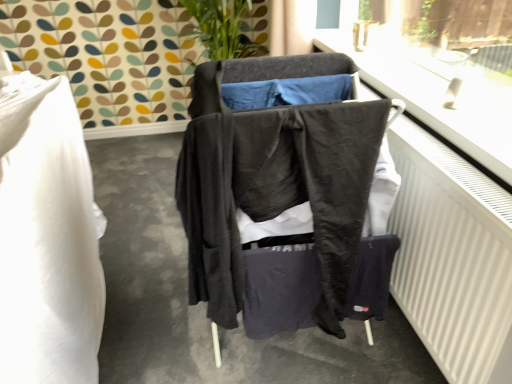
What are the coordinates of `matte black clothing at center` in the screenshot? It's located at (205, 304).

I want to click on matte black clothing at center, so click(205, 304).

Is white plastic window frame at upper right aimed at white fluffy pillow at left?

No, white plastic window frame at upper right does not turn towards white fluffy pillow at left.

From the image's perspective, between white plastic window frame at upper right and white fluffy pillow at left, which one is located above?

white plastic window frame at upper right is shown above in the image.

Can you tell me how much white plastic window frame at upper right and white fluffy pillow at left differ in facing direction?

They differ by 1.03 degrees in their facing directions.

Is white plastic window frame at upper right not near white fluffy pillow at left?

Absolutely, white plastic window frame at upper right is distant from white fluffy pillow at left.

From the image's perspective, does matte black clothing at center appear higher than white plastic window frame at upper right?

No, from the image's perspective, matte black clothing at center is not above white plastic window frame at upper right.

Is matte black clothing at center positioned with its back to white plastic window frame at upper right?

matte black clothing at center is not turned away from white plastic window frame at upper right.

Relative to white plastic window frame at upper right, is matte black clothing at center in front or behind?

Clearly, matte black clothing at center is behind white plastic window frame at upper right.

Does matte black clothing at center touch white plastic window frame at upper right?

There is a gap between matte black clothing at center and white plastic window frame at upper right.

Consider the image. Which of these two, dark gray fabric jacket at center or matte black clothing at center, is thinner?

dark gray fabric jacket at center is thinner.

Is dark gray fabric jacket at center looking in the opposite direction of matte black clothing at center?

dark gray fabric jacket at center does not have its back to matte black clothing at center.

The width and height of the screenshot is (512, 384). Find the location of `concrete below the dark gray fabric jacket at center (from a real-world perspective)`. concrete below the dark gray fabric jacket at center (from a real-world perspective) is located at coordinates (205, 304).

Is matte black clothing at center surrounded by dark gray fabric jacket at center?

No, matte black clothing at center is not surrounded by dark gray fabric jacket at center.

Considering the relative positions of white matte radiator at right and white plastic window frame at upper right in the image provided, is white matte radiator at right to the left or to the right of white plastic window frame at upper right?

From the image, it's evident that white matte radiator at right is to the left of white plastic window frame at upper right.

Which point is more distant from viewer, (451,218) or (423,76)?

The point (423,76) is farther from the camera.

Can you confirm if white matte radiator at right is taller than white plastic window frame at upper right?

Correct, white matte radiator at right is much taller as white plastic window frame at upper right.

Is white matte radiator at right wider than white plastic window frame at upper right?

In fact, white matte radiator at right might be narrower than white plastic window frame at upper right.

Based on the photo, what's the angular difference between dark gray fabric jacket at center and white plastic window frame at upper right's facing directions?

The angle between the facing direction of dark gray fabric jacket at center and the facing direction of white plastic window frame at upper right is 2.27 degrees.

How far apart are dark gray fabric jacket at center and white plastic window frame at upper right?

dark gray fabric jacket at center and white plastic window frame at upper right are 26.25 inches apart.

Is point (338, 115) more distant than point (485, 137)?

No, (338, 115) is in front of (485, 137).

Are dark gray fabric jacket at center and white plastic window frame at upper right located far from each other?

Actually, dark gray fabric jacket at center and white plastic window frame at upper right are a little close together.

Would you consider dark gray fabric jacket at center to be distant from white matte radiator at right?

Actually, dark gray fabric jacket at center and white matte radiator at right are a little close together.

Between dark gray fabric jacket at center and white matte radiator at right, which one appears on the left side from the viewer's perspective?

dark gray fabric jacket at center.

Between dark gray fabric jacket at center and white matte radiator at right, which one is positioned in front?

white matte radiator at right is more forward.

Which of these two, matte black clothing at center or white fluffy pillow at left, is bigger?

matte black clothing at center is bigger.

Is matte black clothing at center beside white fluffy pillow at left?

No.

Find the location of a particular element. window frame on the right of white fluffy pillow at left is located at coordinates (436, 97).

Locate an element on the screen. This screenshot has height=384, width=512. concrete behind the white plastic window frame at upper right is located at coordinates (205, 304).

Considering their positions, is white plastic window frame at upper right positioned further to dark gray fabric jacket at center than matte black clothing at center?

Based on the image, white plastic window frame at upper right appears to be further to dark gray fabric jacket at center.

When comparing their distances from white matte radiator at right, does matte black clothing at center or white plastic window frame at upper right seem closer?

white plastic window frame at upper right is closer to white matte radiator at right.

Estimate the real-world distances between objects in this image. Which object is further from white plastic window frame at upper right, dark gray fabric jacket at center or white fluffy pillow at left?

The object further to white plastic window frame at upper right is white fluffy pillow at left.

Which object lies further to the anchor point white matte radiator at right, white plastic window frame at upper right or dark gray fabric jacket at center?

dark gray fabric jacket at center lies further to white matte radiator at right than the other object.

From the image, which object appears to be farther from white fluffy pillow at left, white matte radiator at right or white plastic window frame at upper right?

white plastic window frame at upper right lies further to white fluffy pillow at left than the other object.

Estimate the real-world distances between objects in this image. Which object is further from white plastic window frame at upper right, matte black clothing at center or white fluffy pillow at left?

white fluffy pillow at left is positioned further to the anchor white plastic window frame at upper right.

When comparing their distances from white matte radiator at right, does white fluffy pillow at left or white plastic window frame at upper right seem further?

Among the two, white fluffy pillow at left is located further to white matte radiator at right.

Consider the image. Considering their positions, is white matte radiator at right positioned further to matte black clothing at center than white fluffy pillow at left?

Based on the image, white matte radiator at right appears to be further to matte black clothing at center.

Where is `radiator between white fluffy pillow at left and white plastic window frame at upper right from left to right`? radiator between white fluffy pillow at left and white plastic window frame at upper right from left to right is located at coordinates (452, 257).

Identify the location of jacket located between white fluffy pillow at left and white matte radiator at right in the left-right direction. This screenshot has height=384, width=512. (276, 193).

The height and width of the screenshot is (384, 512). Identify the location of concrete between white fluffy pillow at left and white plastic window frame at upper right in the horizontal direction. (205, 304).

Locate an element on the screen. This screenshot has height=384, width=512. jacket that lies between white plastic window frame at upper right and white matte radiator at right from top to bottom is located at coordinates (276, 193).